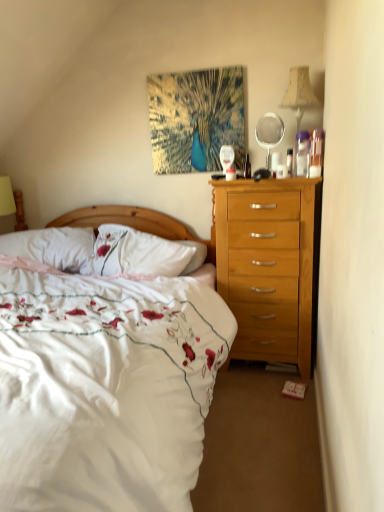
Question: Considering their positions, is white floral fabric bed at center located in front of or behind beige fabric lampshade at upper right?

Choices:
 (A) front
 (B) behind

Answer: (A)

Question: Which is correct: white floral fabric bed at center is inside beige fabric lampshade at upper right, or outside of it?

Choices:
 (A) outside
 (B) inside

Answer: (A)

Question: Which is farther from the white soft pillow at left?

Choices:
 (A) matte white coffee cup at upper right
 (B) clear plastic mirror at upper right
 (C) white floral fabric bed at center
 (D) beige fabric lampshade at upper right

Answer: (D)

Question: Based on their relative distances, which object is farther from the clear plastic mirror at upper right?

Choices:
 (A) beige fabric lampshade at upper right
 (B) matte white coffee cup at upper right
 (C) white floral fabric bed at center
 (D) white soft pillow at left

Answer: (C)